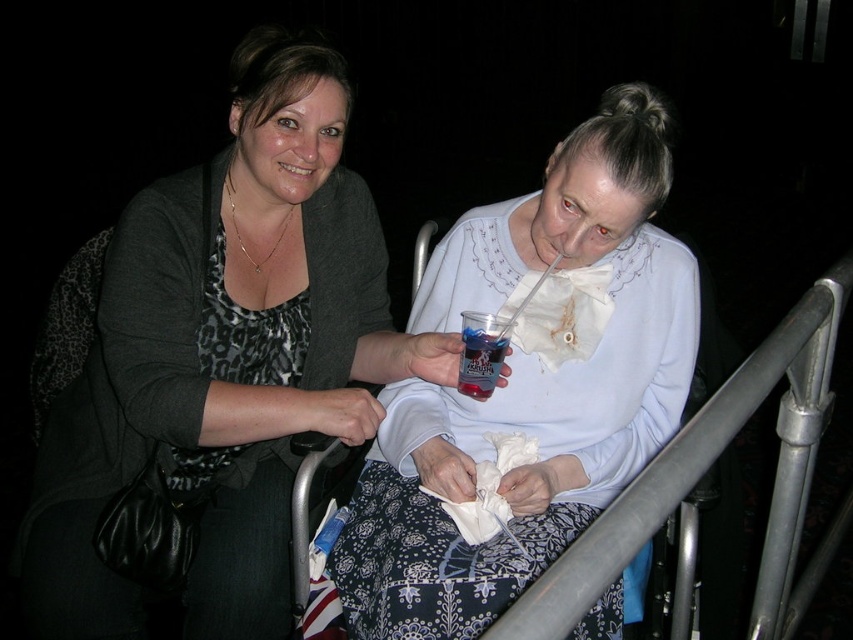
Question: Considering the real-world distances, which object is farthest from the white lace blouse at center?

Choices:
 (A) matte black sweater at center
 (B) translucent plastic cup at center

Answer: (A)

Question: Among these points, which one is nearest to the camera?

Choices:
 (A) (415, 481)
 (B) (277, 412)

Answer: (B)

Question: Is matte black sweater at center below translucent plastic cup at center?

Choices:
 (A) yes
 (B) no

Answer: (B)

Question: Can you confirm if matte black sweater at center is wider than translucent plastic cup at center?

Choices:
 (A) yes
 (B) no

Answer: (A)

Question: Can you confirm if white lace blouse at center is wider than translucent plastic cup at center?

Choices:
 (A) no
 (B) yes

Answer: (B)

Question: Which point is farther to the camera?

Choices:
 (A) (219, 256)
 (B) (467, 387)

Answer: (A)